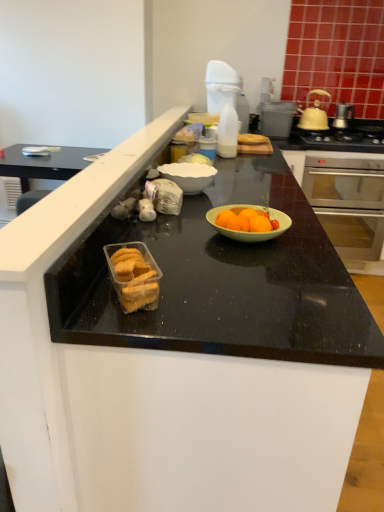
Locate an element on the screen. translucent plastic container of cookies at center is located at coordinates (134, 275).

From the picture: What is the approximate width of stainless steel oven at right?

It is 24.52 inches.

Describe the element at coordinates (342, 115) in the screenshot. I see `silver metallic pot at upper right, acting as the 2th pot/pan starting from the left` at that location.

What is the approximate height of metallic silver gas stove at upper right?

metallic silver gas stove at upper right is 9.00 centimeters in height.

The image size is (384, 512). Describe the element at coordinates (346, 138) in the screenshot. I see `metallic silver gas stove at upper right` at that location.

Consider the image. What is the approximate width of black granite counter top at center?

The width of black granite counter top at center is 24.04 inches.

I want to click on yellow matte pot at upper right, positioned as the 1th pot/pan in left-to-right order, so click(315, 111).

Which object is closer to the camera, metallic gray toaster at upper right or black granite counter top at center?

black granite counter top at center.

From a real-world perspective, who is located higher, metallic gray toaster at upper right or black granite counter top at center?

In real-world perspective, metallic gray toaster at upper right is above.

How different are the orientations of metallic gray toaster at upper right and black granite counter top at center in degrees?

The angle between the facing direction of metallic gray toaster at upper right and the facing direction of black granite counter top at center is 90 degrees.

Who is bigger, black granite counter top at center or stainless steel oven at right?

Bigger between the two is black granite counter top at center.

Is black granite counter top at center thinner than stainless steel oven at right?

Yes.

Is point (108, 325) farther from camera compared to point (365, 192)?

No, (108, 325) is in front of (365, 192).

Is black granite counter top at center directly adjacent to stainless steel oven at right?

No, black granite counter top at center is not touching stainless steel oven at right.

Could metallic gray toaster at upper right be considered to be inside translucent plastic container of cookies at center?

Actually, metallic gray toaster at upper right is outside translucent plastic container of cookies at center.

Who is taller, translucent plastic container of cookies at center or metallic gray toaster at upper right?

Standing taller between the two is metallic gray toaster at upper right.

From the image's perspective, between translucent plastic container of cookies at center and metallic gray toaster at upper right, who is located below?

translucent plastic container of cookies at center is shown below in the image.

You are a GUI agent. You are given a task and a screenshot of the screen. Output one action in this format:
    pyautogui.click(x=<x>, y=<y>)
    Task: Click on the appliance to the right of translucent plastic container of cookies at center
    
    Given the screenshot: What is the action you would take?
    pyautogui.click(x=276, y=118)

Does point (209, 81) come in front of point (102, 308)?

No, it is behind (102, 308).

Considering the relative sizes of white plastic spray bottle at upper center and black granite counter top at center in the image provided, is white plastic spray bottle at upper center thinner than black granite counter top at center?

Indeed, white plastic spray bottle at upper center has a lesser width compared to black granite counter top at center.

In terms of height, does white plastic spray bottle at upper center look taller or shorter compared to black granite counter top at center?

Clearly, white plastic spray bottle at upper center is shorter compared to black granite counter top at center.

Does white plastic spray bottle at upper center turn towards black granite counter top at center?

No, white plastic spray bottle at upper center is not facing towards black granite counter top at center.

Between yellow matte pot at upper right, positioned as the 1th pot/pan in left-to-right order, and stainless steel oven at right, which one has less height?

yellow matte pot at upper right, positioned as the 1th pot/pan in left-to-right order.

Based on the photo, can you tell me how much yellow matte pot at upper right, arranged as the second pot/pan when viewed from the right, and stainless steel oven at right differ in facing direction?

0.00174 degrees.

Could you tell me if yellow matte pot at upper right, arranged as the second pot/pan when viewed from the right, is turned towards stainless steel oven at right?

No, yellow matte pot at upper right, arranged as the second pot/pan when viewed from the right, is not turned towards stainless steel oven at right.

From the image's perspective, does yellow matte pot at upper right, arranged as the second pot/pan when viewed from the right, appear lower than stainless steel oven at right?

Actually, yellow matte pot at upper right, arranged as the second pot/pan when viewed from the right, appears above stainless steel oven at right in the image.

Are stainless steel oven at right and black granite counter top at center making contact?

stainless steel oven at right and black granite counter top at center are clearly separated.

Based on the photo, could you tell me if stainless steel oven at right is turned towards black granite counter top at center?

No, stainless steel oven at right does not turn towards black granite counter top at center.

Where is `counter top on the left side of stainless steel oven at right`? counter top on the left side of stainless steel oven at right is located at coordinates (222, 282).

Can you confirm if stainless steel oven at right is positioned to the right of black granite counter top at center?

Indeed, stainless steel oven at right is positioned on the right side of black granite counter top at center.

Can you confirm if metallic gray toaster at upper right is positioned to the left of translucent plastic bottle at upper center?

No, metallic gray toaster at upper right is not to the left of translucent plastic bottle at upper center.

From the image's perspective, between metallic gray toaster at upper right and translucent plastic bottle at upper center, which one is located above?

metallic gray toaster at upper right is shown above in the image.

Is metallic gray toaster at upper right turned away from translucent plastic bottle at upper center?

No, metallic gray toaster at upper right is not facing away from translucent plastic bottle at upper center.

Who is shorter, metallic gray toaster at upper right or translucent plastic bottle at upper center?

metallic gray toaster at upper right is shorter.

This screenshot has width=384, height=512. What are the coordinates of `appliance that appears on the right of black granite counter top at center` in the screenshot? It's located at (276, 118).

This screenshot has width=384, height=512. Identify the location of counter top located in front of the stainless steel oven at right. (222, 282).

Considering their positions, is metallic gray toaster at upper right positioned closer to stainless steel oven at right than yellow matte pot at upper right, positioned as the 1th pot/pan in left-to-right order?

metallic gray toaster at upper right is closer to stainless steel oven at right.

Estimate the real-world distances between objects in this image. Which object is closer to metallic silver gas stove at upper right, yellow matte pot at upper right, positioned as the 1th pot/pan in left-to-right order, or white plastic spray bottle at upper center?

Among the two, yellow matte pot at upper right, positioned as the 1th pot/pan in left-to-right order, is located nearer to metallic silver gas stove at upper right.

Estimate the real-world distances between objects in this image. Which object is further from silver metallic pot at upper right, marked as the 1th pot/pan in a right-to-left arrangement, metallic gray toaster at upper right or metallic silver gas stove at upper right?

metallic gray toaster at upper right is positioned further to the anchor silver metallic pot at upper right, marked as the 1th pot/pan in a right-to-left arrangement.

Estimate the real-world distances between objects in this image. Which object is further from white plastic spray bottle at upper center, translucent plastic bottle at upper center or silver metallic pot at upper right, marked as the 1th pot/pan in a right-to-left arrangement?

silver metallic pot at upper right, marked as the 1th pot/pan in a right-to-left arrangement, is further to white plastic spray bottle at upper center.

From the image, which object appears to be nearer to white plastic spray bottle at upper center, black granite counter top at center or yellow matte pot at upper right, arranged as the second pot/pan when viewed from the right?

yellow matte pot at upper right, arranged as the second pot/pan when viewed from the right, is positioned closer to the anchor white plastic spray bottle at upper center.

Estimate the real-world distances between objects in this image. Which object is further from black granite counter top at center, metallic gray toaster at upper right or white plastic spray bottle at upper center?

metallic gray toaster at upper right.

Considering their positions, is translucent plastic container of cookies at center positioned closer to metallic silver gas stove at upper right than white plastic spray bottle at upper center?

white plastic spray bottle at upper center.

When comparing their distances from translucent plastic container of cookies at center, does yellow matte pot at upper right, arranged as the second pot/pan when viewed from the right, or metallic silver gas stove at upper right seem further?

yellow matte pot at upper right, arranged as the second pot/pan when viewed from the right, is further to translucent plastic container of cookies at center.

Locate an element on the screen. The width and height of the screenshot is (384, 512). gas stove between yellow matte pot at upper right, arranged as the second pot/pan when viewed from the right, and stainless steel oven at right vertically is located at coordinates (346, 138).

Where is `appliance between white plastic spray bottle at upper center and yellow matte pot at upper right, positioned as the 1th pot/pan in left-to-right order`? appliance between white plastic spray bottle at upper center and yellow matte pot at upper right, positioned as the 1th pot/pan in left-to-right order is located at coordinates (276, 118).

Find the location of a particular element. appliance located between translucent plastic bottle at upper center and silver metallic pot at upper right, marked as the 1th pot/pan in a right-to-left arrangement, in the left-right direction is located at coordinates click(276, 118).

Where is `appliance located between translucent plastic bottle at upper center and yellow matte pot at upper right, arranged as the second pot/pan when viewed from the right, in the depth direction`? The height and width of the screenshot is (512, 384). appliance located between translucent plastic bottle at upper center and yellow matte pot at upper right, arranged as the second pot/pan when viewed from the right, in the depth direction is located at coordinates (276, 118).